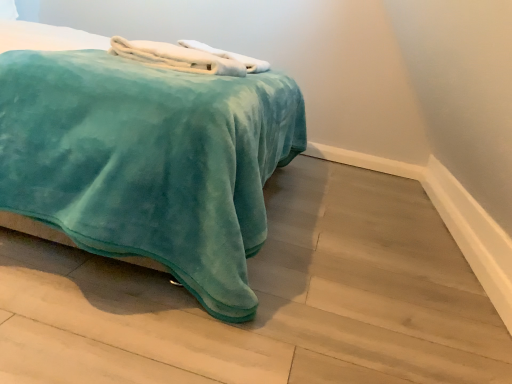
Question: Is teal velvety bed at center positioned beyond the bounds of white fluffy bath towel at upper center, which is the first bath towel from back to front?

Choices:
 (A) yes
 (B) no

Answer: (A)

Question: Considering the relative sizes of teal velvety bed at center and white fluffy bath towel at upper center, the second bath towel when ordered from front to back, in the image provided, is teal velvety bed at center taller than white fluffy bath towel at upper center, the second bath towel when ordered from front to back,?

Choices:
 (A) yes
 (B) no

Answer: (A)

Question: Is teal velvety bed at center aimed at white fluffy bath towel at upper center, which is the first bath towel from back to front?

Choices:
 (A) no
 (B) yes

Answer: (B)

Question: Is teal velvety bed at center to the left of white fluffy bath towel at upper center, the second bath towel when ordered from front to back, from the viewer's perspective?

Choices:
 (A) no
 (B) yes

Answer: (B)

Question: Is teal velvety bed at center with white fluffy bath towel at upper center, which is the first bath towel from back to front?

Choices:
 (A) yes
 (B) no

Answer: (B)

Question: Considering the positions of white soft towel at upper center, the 2th bath towel when ordered from back to front, and teal velvety bed at center in the image, is white soft towel at upper center, the 2th bath towel when ordered from back to front, taller or shorter than teal velvety bed at center?

Choices:
 (A) short
 (B) tall

Answer: (A)

Question: Considering the positions of white soft towel at upper center, the 2th bath towel when ordered from back to front, and teal velvety bed at center in the image, is white soft towel at upper center, the 2th bath towel when ordered from back to front, wider or thinner than teal velvety bed at center?

Choices:
 (A) thin
 (B) wide

Answer: (A)

Question: Is white soft towel at upper center, the 2th bath towel when ordered from back to front, in front of or behind teal velvety bed at center in the image?

Choices:
 (A) front
 (B) behind

Answer: (B)

Question: Is point (190, 64) positioned closer to the camera than point (155, 96)?

Choices:
 (A) closer
 (B) farther

Answer: (B)

Question: Based on their sizes in the image, would you say white soft towel at upper center, the 2th bath towel when ordered from back to front, is bigger or smaller than white fluffy bath towel at upper center, which is the first bath towel from back to front?

Choices:
 (A) big
 (B) small

Answer: (B)

Question: Considering their positions, is white soft towel at upper center, the first bath towel in the front-to-back sequence, located in front of or behind white fluffy bath towel at upper center, the second bath towel when ordered from front to back?

Choices:
 (A) front
 (B) behind

Answer: (A)

Question: Is white soft towel at upper center, the 2th bath towel when ordered from back to front, inside the boundaries of white fluffy bath towel at upper center, which is the first bath towel from back to front, or outside?

Choices:
 (A) outside
 (B) inside

Answer: (A)

Question: Is point (186, 43) positioned closer to the camera than point (229, 57)?

Choices:
 (A) closer
 (B) farther

Answer: (B)

Question: In the image, is teal velvety bed at center on the left side or the right side of white soft towel at upper center, the first bath towel in the front-to-back sequence?

Choices:
 (A) right
 (B) left

Answer: (B)

Question: Relative to white soft towel at upper center, the first bath towel in the front-to-back sequence, is teal velvety bed at center in front or behind?

Choices:
 (A) front
 (B) behind

Answer: (A)